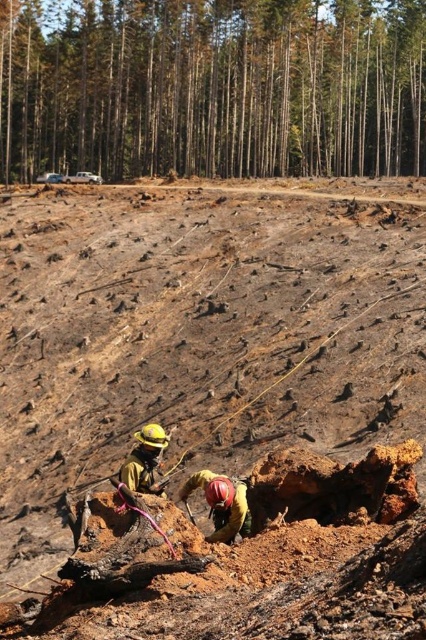
You are a safety inspector in the forest area. You see a brown wood tree at upper center and a yellow hard hat at lower left. Which object is larger in size?

The brown wood tree at upper center is bigger than the yellow hard hat at lower left.

You are a surveyor trying to locate the brown wood tree at upper center in the forest scene. According to the coordinates provided, where exactly is the tree located?

The brown wood tree at upper center is located at coordinates point (212, 88).